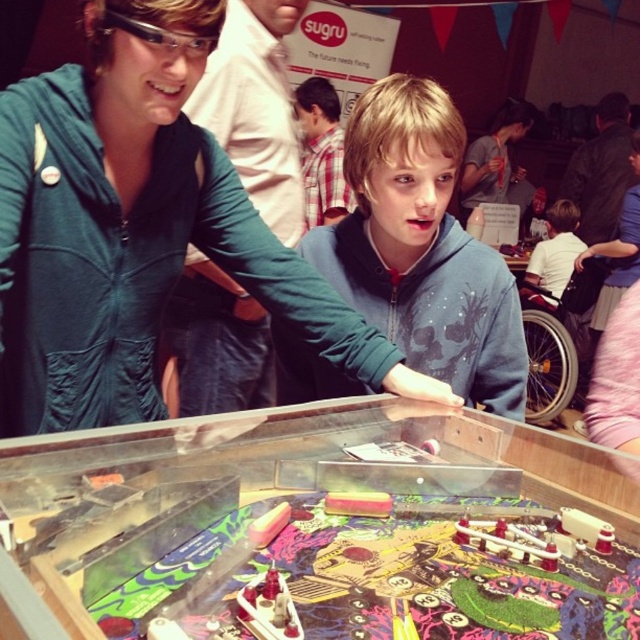
You are standing in front of the pinball machine at the fair. There is a point marked at coordinates (136, 228). What object is located at that point?

The point at (136, 228) is occupied by the matte green hoodie at center.

You are standing at the center of the image and want to reach the blue fleece hoodie at center. Which direction should you move relative to the point at coordinates (x=420, y=248)?

The blue fleece hoodie at center is located exactly at the point with coordinates (x=420, y=248), so you don not need to move in any direction to reach it.